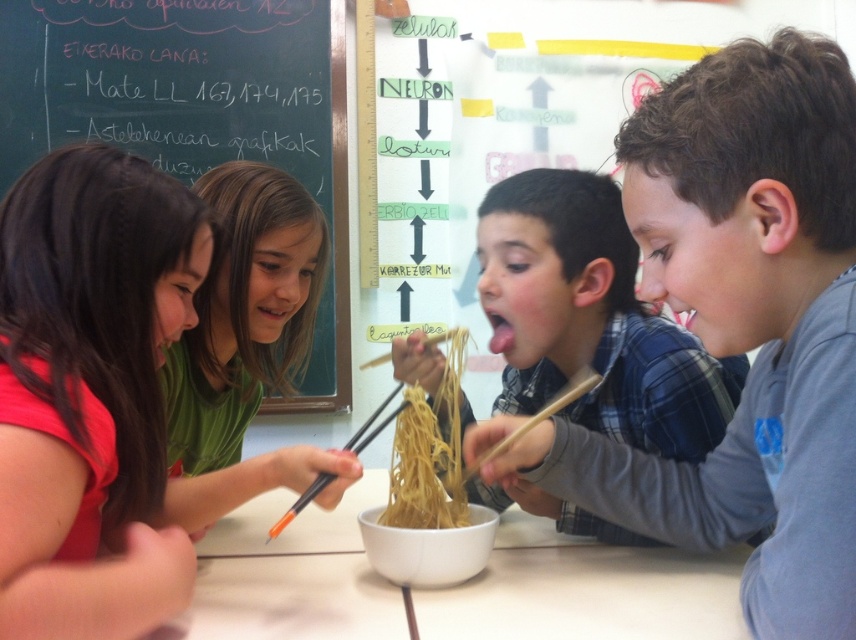
You are a teacher observing the classroom scene. You notice the white matte table at center and the wooden chopsticks at center. Based on their positions, which object is closer to the floor?

The white matte table at center is closer to the floor because it is positioned below the wooden chopsticks at center.

You are a teacher observing the classroom scene. You notice the matte red shirt at left and the yellow matte noodles at center. Which object is positioned to the left of the other?

The matte red shirt at left is positioned to the left of the yellow matte noodles at center.